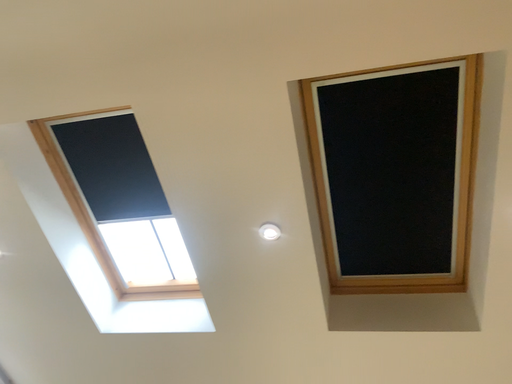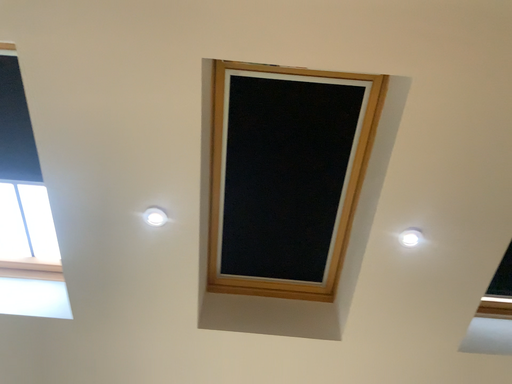
Question: Which way did the camera rotate in the video?

Choices:
 (A) rotated right
 (B) rotated left

Answer: (A)